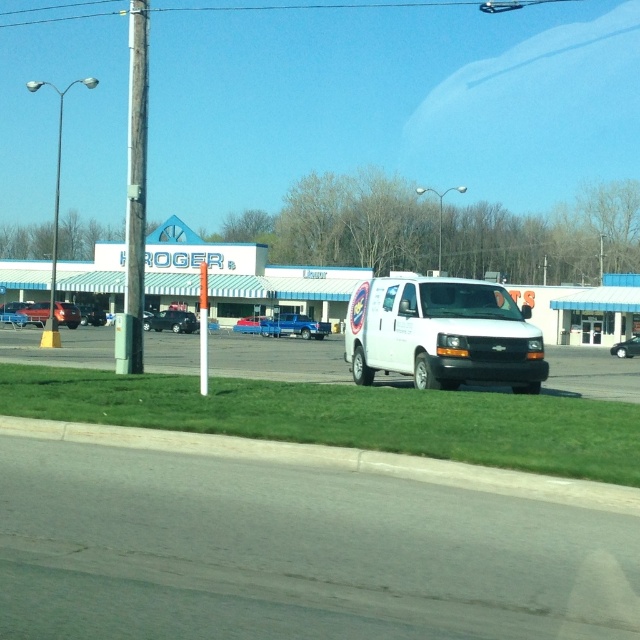
How distant is wooden utility pole at left from shiny black sedan at center?

The distance of wooden utility pole at left from shiny black sedan at center is 167.33 feet.

This screenshot has height=640, width=640. Describe the element at coordinates (134, 186) in the screenshot. I see `wooden utility pole at left` at that location.

Which is in front, point (145, 189) or point (637, 337)?

Point (145, 189) is in front.

Find the location of a particular element. wooden utility pole at left is located at coordinates click(134, 186).

Locate an element on the screen. The height and width of the screenshot is (640, 640). wooden utility pole at left is located at coordinates (134, 186).

Looking at this image, between wooden utility pole at left and white plastic pole at center, which one appears on the left side from the viewer's perspective?

wooden utility pole at left is more to the left.

Where is `wooden utility pole at left`? wooden utility pole at left is located at coordinates (134, 186).

Where is `wooden utility pole at left`? The image size is (640, 640). wooden utility pole at left is located at coordinates (134, 186).

Is metallic red car at center thinner than shiny black suv at center-left?

Yes.

Is metallic red car at center closer to camera compared to shiny black suv at center-left?

That is False.

Who is more distant from viewer, (29, 317) or (186, 310)?

The point (186, 310) is behind.

This screenshot has width=640, height=640. I want to click on metallic red car at center, so click(x=67, y=314).